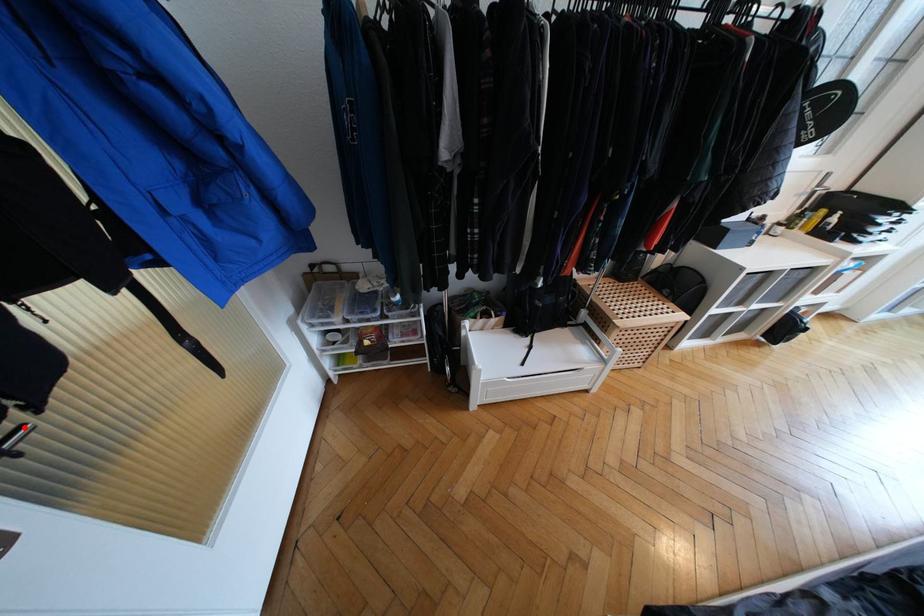
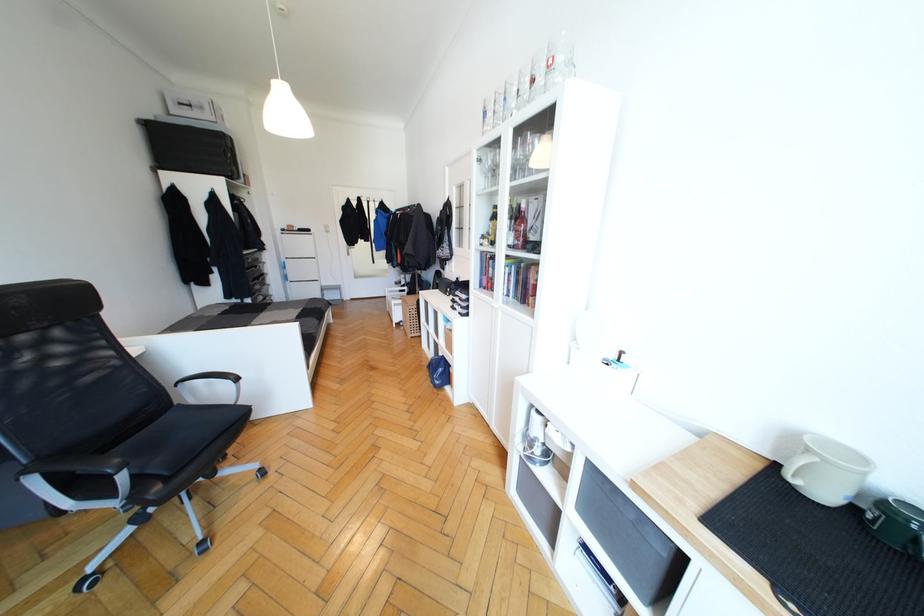
Question: I am providing you with two images of the same scene from different viewpoints. A red point is marked on the first image. Is the red point's position out of view in image 2?

Choices:
 (A) Yes
 (B) No

Answer: (A)